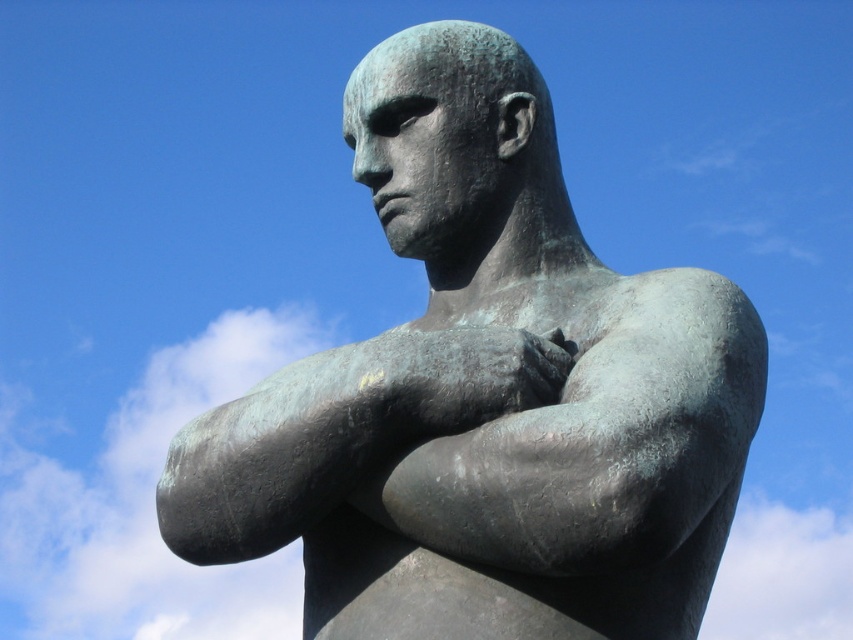
Between green patina bronze statue at center and bronze textured arm at center, which one is positioned higher?

green patina bronze statue at center is above.

Which is in front, point (514, 170) or point (514, 332)?

Point (514, 332)

Identify the location of green patina bronze statue at center. This screenshot has height=640, width=853. (486, 396).